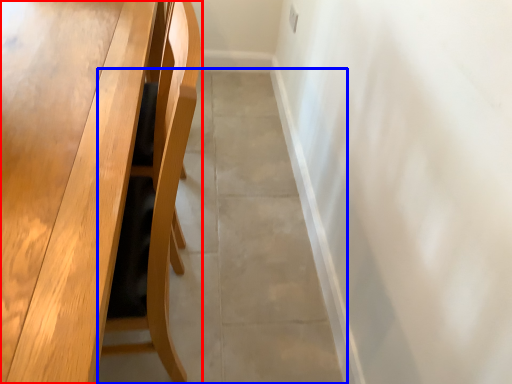
Question: Which object appears closest to the camera in this image, table (highlighted by a red box) or concrete (highlighted by a blue box)?

Choices:
 (A) table
 (B) concrete

Answer: (A)